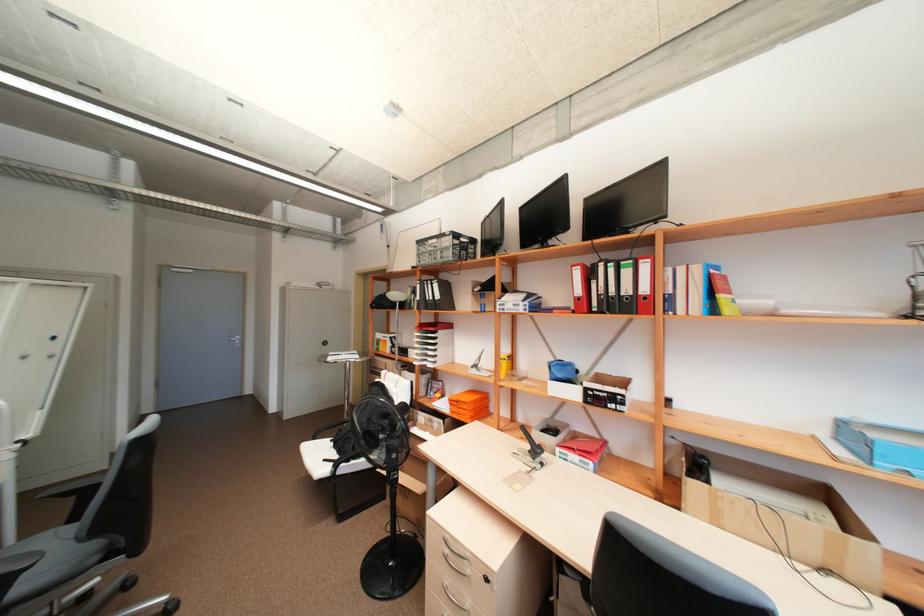
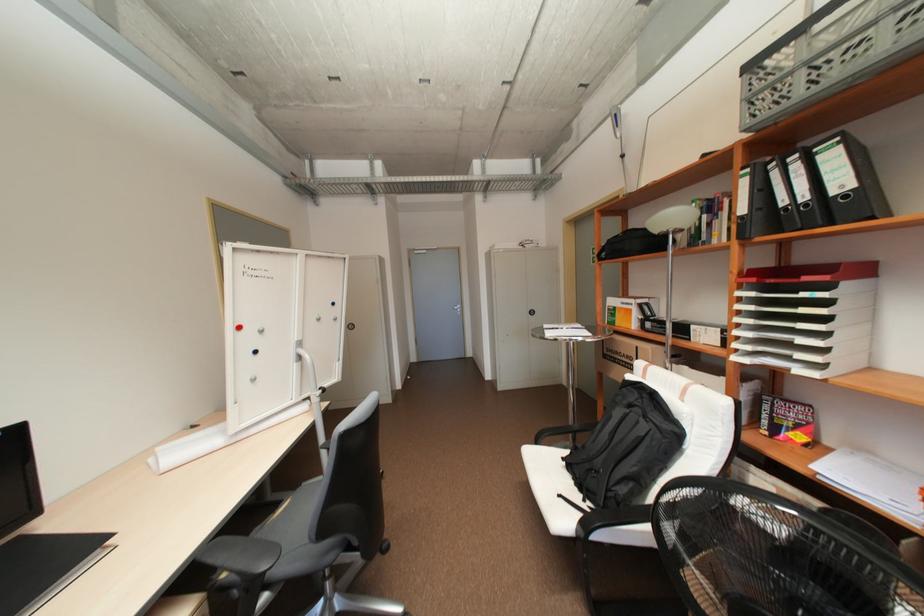
In the second image, find the point that corresponds to point (436, 298) in the first image.

(810, 197)